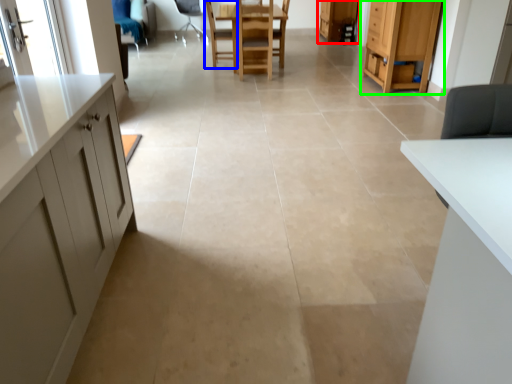
Question: Which is nearer to the cabinetry (highlighted by a red box)? chair (highlighted by a blue box) or cabinetry (highlighted by a green box).

Choices:
 (A) chair
 (B) cabinetry

Answer: (A)